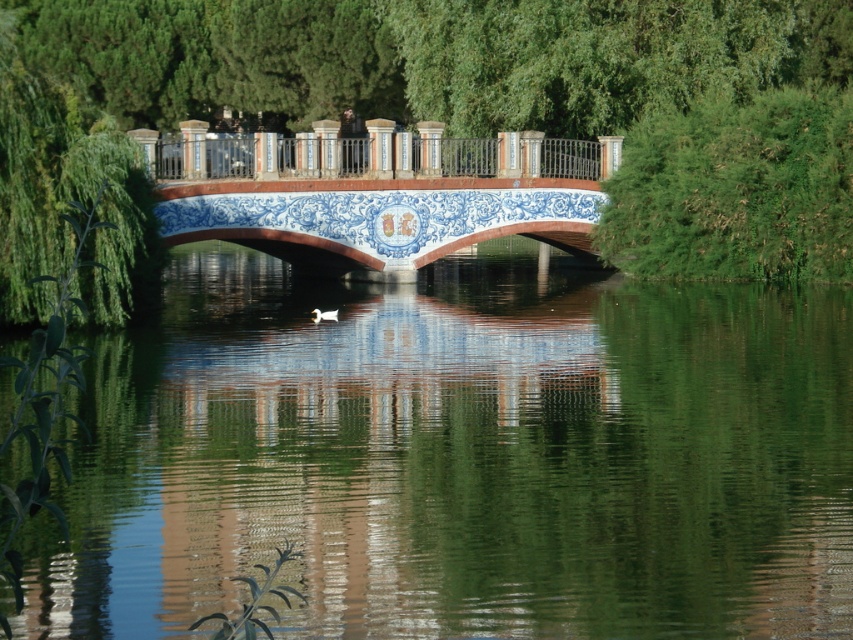
Question: Can you confirm if green leafy tree at center is positioned to the right of metallic polished railing at center?

Choices:
 (A) yes
 (B) no

Answer: (A)

Question: Which object is the closest to the green leafy tree at center?

Choices:
 (A) metallic polished railing at center
 (B) green reflective water at center
 (C) blue ceramic bridge at center

Answer: (C)

Question: Estimate the real-world distances between objects in this image. Which object is closer to the green reflective water at center?

Choices:
 (A) metallic polished railing at center
 (B) green leafy tree at center
 (C) blue ceramic bridge at center

Answer: (C)

Question: Which is nearer to the metallic polished railing at center?

Choices:
 (A) green leafy tree at center
 (B) green reflective water at center

Answer: (A)

Question: From the image, what is the correct spatial relationship of green reflective water at center in relation to blue ceramic bridge at center?

Choices:
 (A) above
 (B) below

Answer: (B)

Question: Can you confirm if green reflective water at center is wider than blue ceramic bridge at center?

Choices:
 (A) no
 (B) yes

Answer: (B)